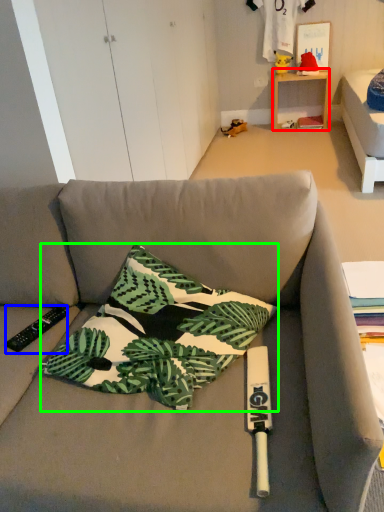
Question: Based on their relative distances, which object is nearer to table (highlighted by a red box)? Choose from remote control (highlighted by a blue box) and pillow (highlighted by a green box).

Choices:
 (A) remote control
 (B) pillow

Answer: (B)